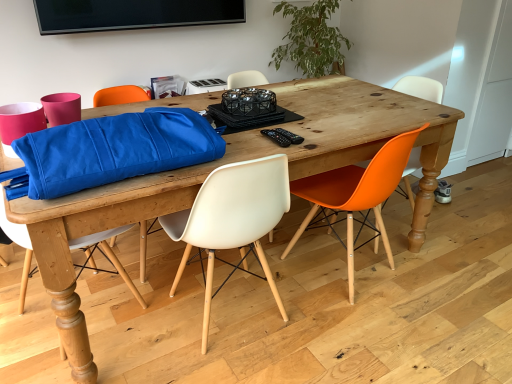
Where is `vacant space in front of black plastic remote control at center, the 1th remote control in the left-to-right sequence`? Image resolution: width=512 pixels, height=384 pixels. vacant space in front of black plastic remote control at center, the 1th remote control in the left-to-right sequence is located at coordinates tap(264, 148).